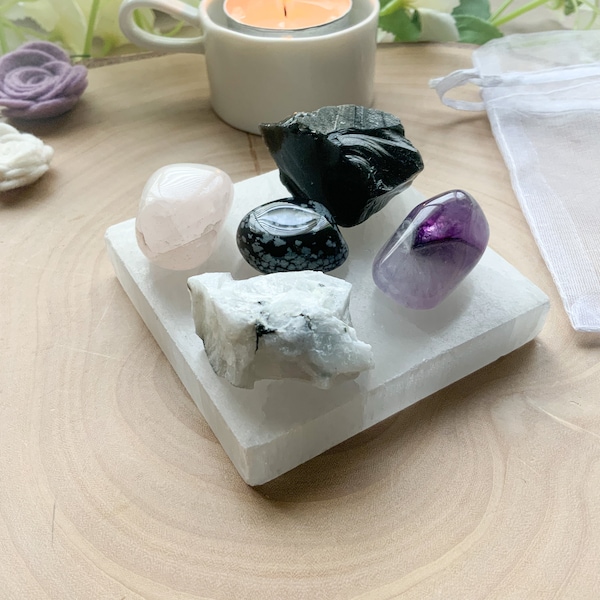
In order to click on ceramic mug in this screenshot , I will do `click(283, 75)`.